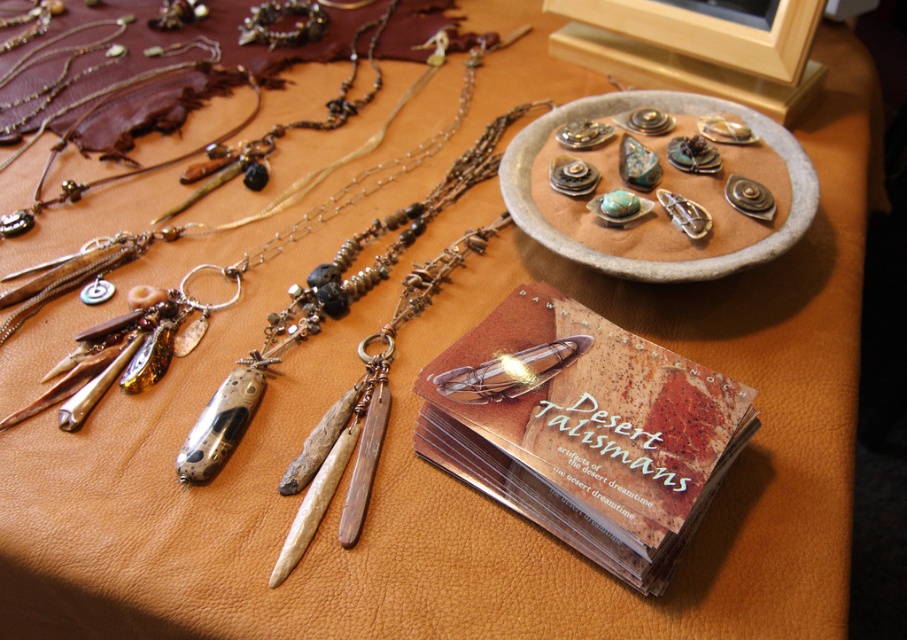
Question: Is translucent plastic cards at center wider than metallic stone pendants at center?

Choices:
 (A) no
 (B) yes

Answer: (B)

Question: Can you confirm if translucent plastic cards at center is positioned below matte silver pendant at center?

Choices:
 (A) yes
 (B) no

Answer: (A)

Question: Among these objects, which one is nearest to the camera?

Choices:
 (A) metallic stone pendants at center
 (B) matte silver pendant at center
 (C) translucent plastic cards at center

Answer: (C)

Question: Is matte silver pendant at center behind metallic stone pendants at center?

Choices:
 (A) no
 (B) yes

Answer: (A)

Question: Among these points, which one is farthest from the camera?

Choices:
 (A) click(x=566, y=198)
 (B) click(x=485, y=384)

Answer: (A)

Question: Which point appears closest to the camera in this image?

Choices:
 (A) (587, 346)
 (B) (618, 140)

Answer: (A)